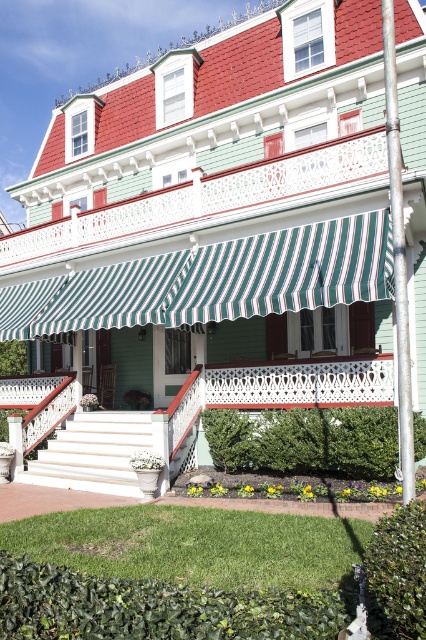
Between green striped awning at center and white painted wood porch at center, which one is positioned higher?

green striped awning at center is above.

Which is behind, point (368, 257) or point (164, 468)?

Positioned behind is point (164, 468).

Does point (322, 300) come in front of point (69, 426)?

Yes.

Locate an element on the screen. Image resolution: width=426 pixels, height=640 pixels. green striped awning at center is located at coordinates (213, 282).